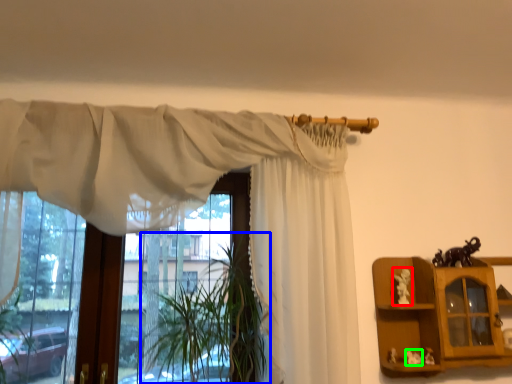
Question: Based on their relative distances, which object is farther from toy (highlighted by a red box)? Choose from plant (highlighted by a blue box) and toy (highlighted by a green box).

Choices:
 (A) plant
 (B) toy

Answer: (A)